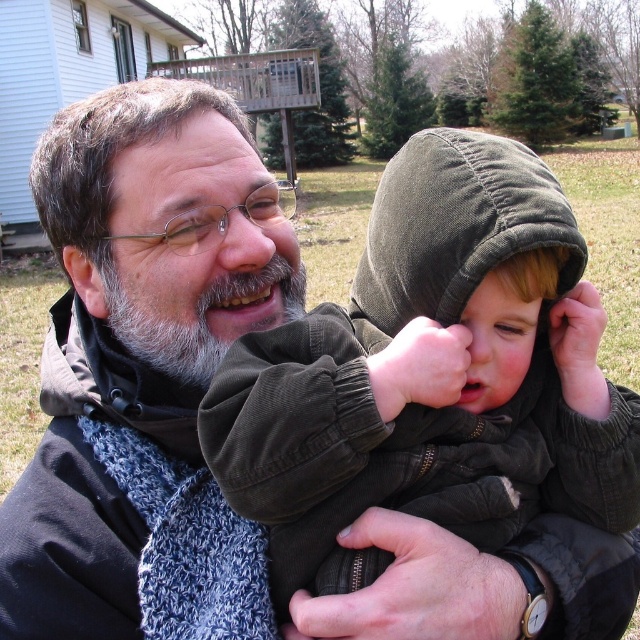
Is point (189, 253) more distant than point (211, 278)?

No.

Does knitted scarf at center appear under graybeard at center?

Indeed, knitted scarf at center is positioned under graybeard at center.

Measure the distance between point (196, 355) and camera.

→ The distance of point (196, 355) from camera is 88.19 centimeters.

This screenshot has width=640, height=640. Identify the location of knitted scarf at center. (134, 337).

Is point (484, 189) farther from camera compared to point (193, 352)?

No, (484, 189) is in front of (193, 352).

Does dark green corduroy hoodie at center have a greater width compared to graybeard at center?

Correct, the width of dark green corduroy hoodie at center exceeds that of graybeard at center.

Is point (598, 442) closer to viewer compared to point (156, 348)?

Yes, it is in front of point (156, 348).

The width and height of the screenshot is (640, 640). I want to click on dark green corduroy hoodie at center, so click(412, 403).

Can you confirm if knitted scarf at center is bigger than dark green corduroy hoodie at center?

Actually, knitted scarf at center might be smaller than dark green corduroy hoodie at center.

This screenshot has height=640, width=640. Identify the location of knitted scarf at center. (134, 337).

Locate an element on the screen. knitted scarf at center is located at coordinates (134, 337).